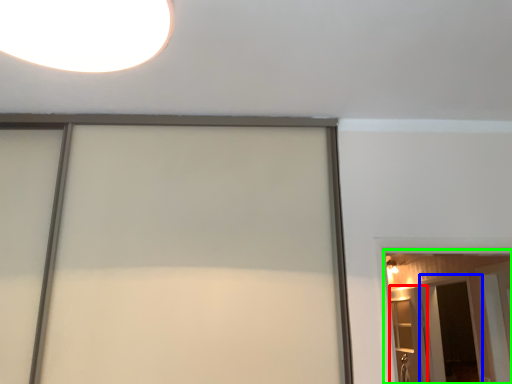
Question: Which is nearer to the elevator (highlighted by a red box)? screen door (highlighted by a blue box) or barn door (highlighted by a green box).

Choices:
 (A) screen door
 (B) barn door

Answer: (A)